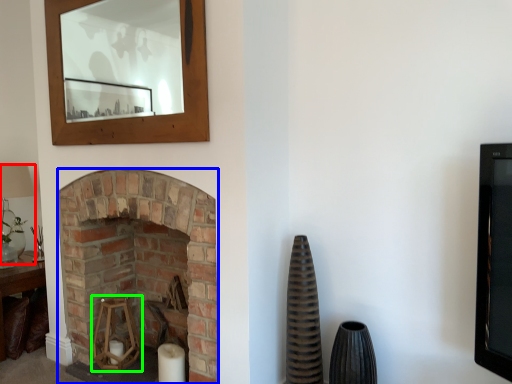
Question: Which object is the farthest from lamp (highlighted by a red box)? Choose among these: fireplace (highlighted by a blue box) or candle holder (highlighted by a green box).

Choices:
 (A) fireplace
 (B) candle holder

Answer: (A)